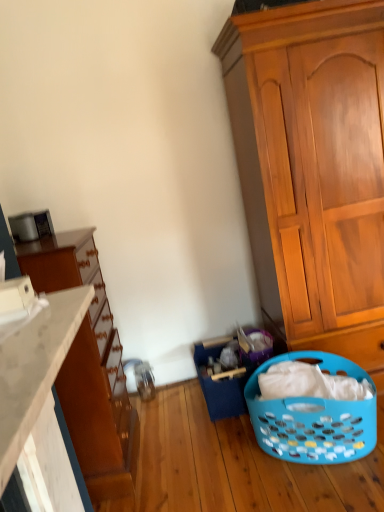
Question: Is white matte countertop at lower left wider or thinner than matte brown dresser at left?

Choices:
 (A) thin
 (B) wide

Answer: (A)

Question: Does point (46, 359) appear closer or farther from the camera than point (105, 306)?

Choices:
 (A) closer
 (B) farther

Answer: (A)

Question: Which object is the farthest from the wooden cabinet at right?

Choices:
 (A) matte brown dresser at left
 (B) blue plastic laundry basket at lower center
 (C) blue plastic laundry basket at lower right
 (D) white matte countertop at lower left

Answer: (D)

Question: Estimate the real-world distances between objects in this image. Which object is closer to the blue plastic laundry basket at lower right?

Choices:
 (A) white matte countertop at lower left
 (B) blue plastic laundry basket at lower center
 (C) wooden cabinet at right
 (D) matte brown dresser at left

Answer: (B)